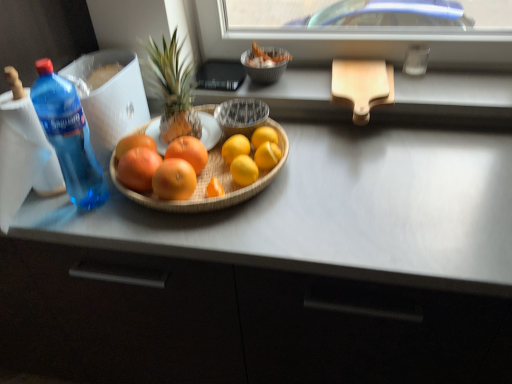
This screenshot has width=512, height=384. Find the location of `vacant space to the left of metallic silver bowl at upper center`. vacant space to the left of metallic silver bowl at upper center is located at coordinates click(x=218, y=84).